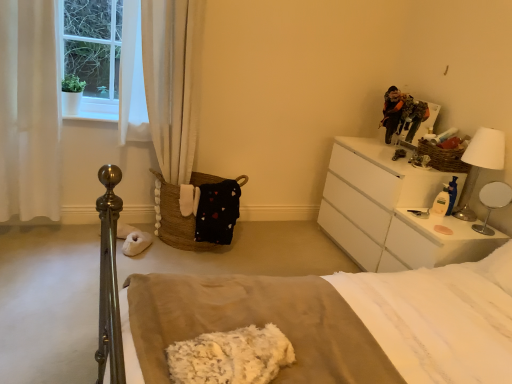
Where is `unoccupied area behind white glossy table lamp at right, the 1th table lamp ordered from the bottom`? This screenshot has height=384, width=512. unoccupied area behind white glossy table lamp at right, the 1th table lamp ordered from the bottom is located at coordinates (467, 221).